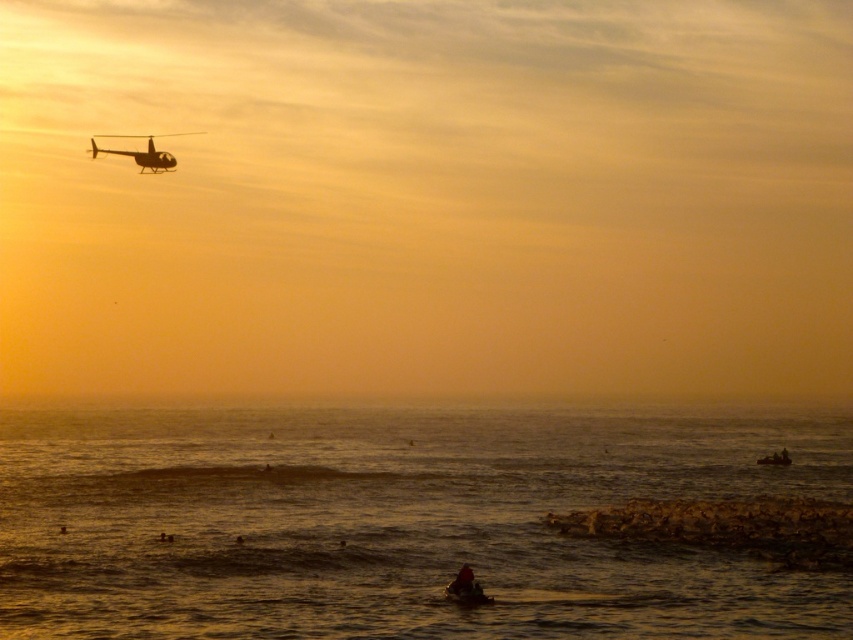
You are standing on the beach and looking at the sunset scene. There is a golden water area marked by the point at coordinates (395, 522). Where exactly is this golden water located in relation to the helicopter in the upper left?

A: The golden water at lower center is located below the helicopter in the upper left.

You are an observer looking at the sunset scene. You notice the golden water at lower center and the metallic silver helicopter at upper left. Which object appears closer to you in terms of vertical position?

The golden water at lower center appears closer to you in terms of vertical position because it has a lesser height compared to the metallic silver helicopter at upper left.